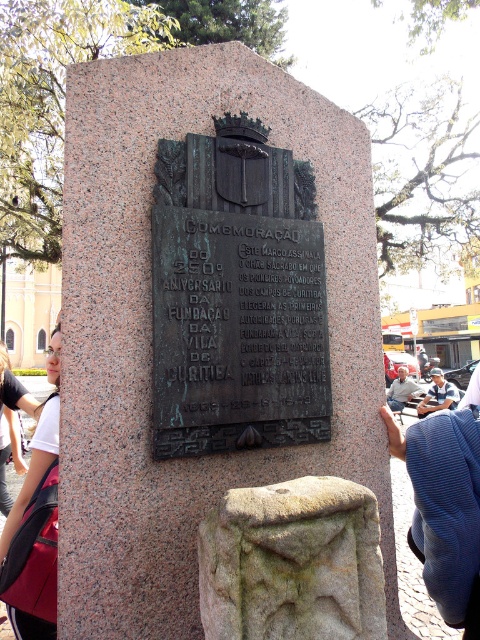
Question: Which of these objects is positioned closest to the granite stone monument at center?

Choices:
 (A) bronze plaque at center
 (B) pink fabric backpack at lower left

Answer: (A)

Question: Can you confirm if pink fabric backpack at lower left is wider than blue denim jacket at lower right?

Choices:
 (A) no
 (B) yes

Answer: (A)

Question: Which point is farther to the camera?

Choices:
 (A) blue cotton shirt at center
 (B) granite stone monument at center
 (C) blue denim jacket at lower right
 (D) gray rough stone at center

Answer: (C)

Question: Is bronze plaque at center to the left of blue denim jacket at lower right from the viewer's perspective?

Choices:
 (A) yes
 (B) no

Answer: (A)

Question: Which of the following is the closest to the observer?

Choices:
 (A) bronze plaque at center
 (B) pink fabric backpack at lower left
 (C) blue denim jacket at lower right
 (D) gray rough stone at center

Answer: (D)

Question: Is gray rough stone at center to the right of blue denim jacket at lower right from the viewer's perspective?

Choices:
 (A) yes
 (B) no

Answer: (B)